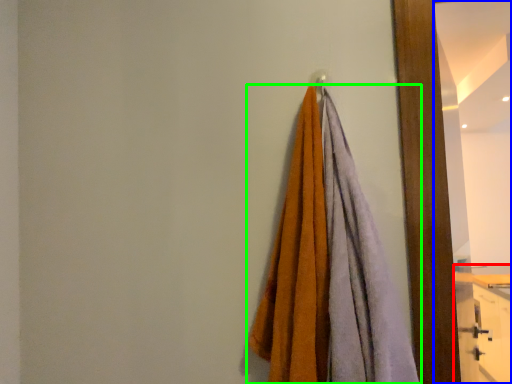
Question: Which object is positioned farthest from dresser (highlighted by a red box)? Select from mirror (highlighted by a blue box) and towel (highlighted by a green box).

Choices:
 (A) mirror
 (B) towel

Answer: (B)